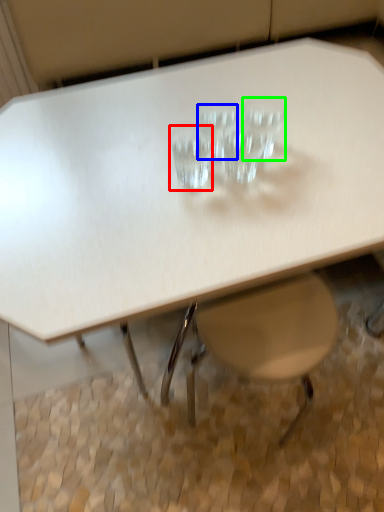
Question: Estimate the real-world distances between objects in this image. Which object is closer to martini glass (highlighted by a red box), martini glass (highlighted by a blue box) or martini glass (highlighted by a green box)?

Choices:
 (A) martini glass
 (B) martini glass

Answer: (A)